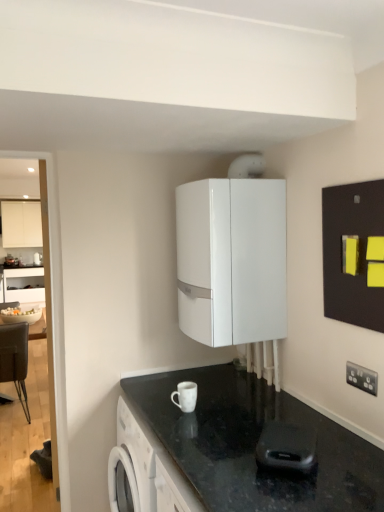
Locate an element on the screen. The height and width of the screenshot is (512, 384). free space to the back side of black rubber remote control at lower center, placed as the third appliance when sorted from left to right is located at coordinates (250, 436).